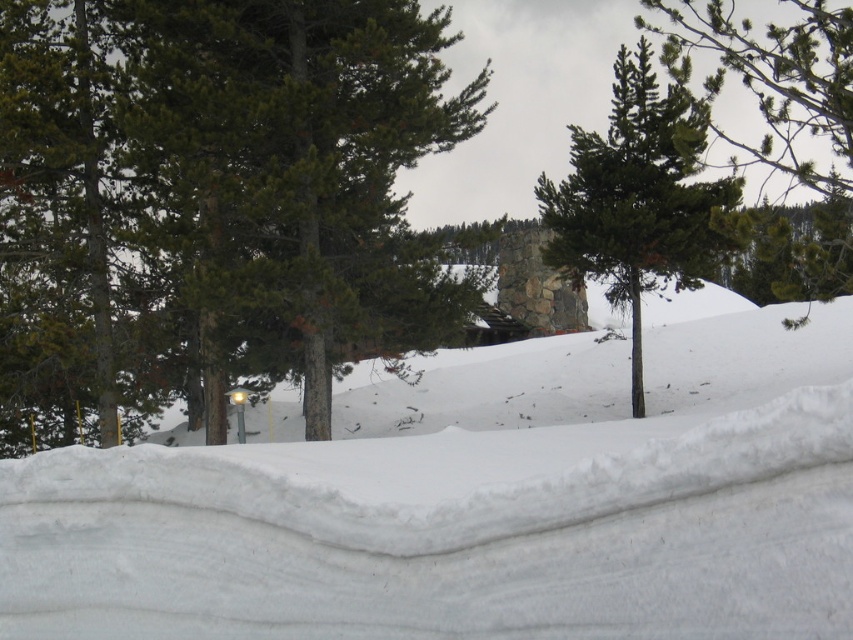
Is the position of green matte tree at left more distant than that of green needle-like at upper right?

Yes, green matte tree at left is further from the viewer.

Where is `green matte tree at left`? Image resolution: width=853 pixels, height=640 pixels. green matte tree at left is located at coordinates (215, 196).

Is green matte tree at left closer to the viewer compared to green matte tree at center?

That is False.

Is green matte tree at left bigger than green matte tree at center?

Actually, green matte tree at left might be smaller than green matte tree at center.

Does point (328, 134) lie in front of point (625, 241)?

Yes, it is.

The image size is (853, 640). In order to click on green matte tree at left in this screenshot , I will do 215,196.

Is green matte tree at center wider than green needle-like at upper right?

In fact, green matte tree at center might be narrower than green needle-like at upper right.

Locate an element on the screen. The image size is (853, 640). green matte tree at center is located at coordinates (637, 196).

Find the location of `green matte tree at center`. green matte tree at center is located at coordinates (637, 196).